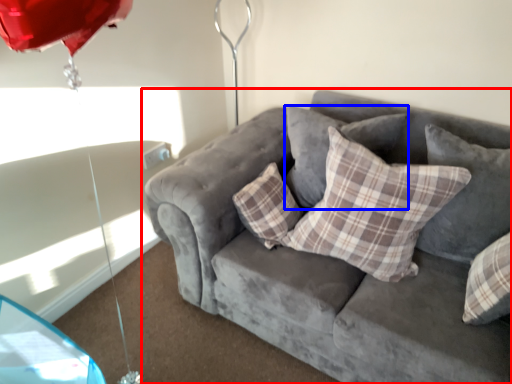
Question: Which of the following is the closest to the observer, studio couch (highlighted by a red box) or pillow (highlighted by a blue box)?

Choices:
 (A) studio couch
 (B) pillow

Answer: (A)